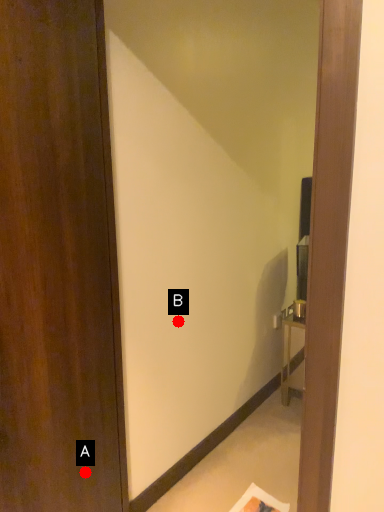
Question: Two points are circled on the image, labeled by A and B beside each circle. Among these points, which one is nearest to the camera?

Choices:
 (A) A is closer
 (B) B is closer

Answer: (A)